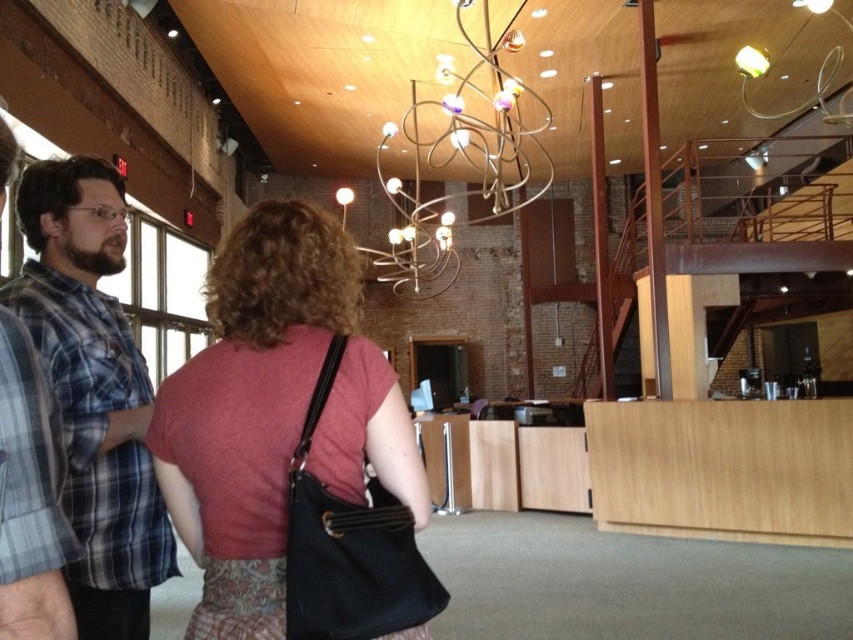
Between point (79, 420) and point (379, 140), which one is positioned in front?

Positioned in front is point (79, 420).

Is blue plaid shirt at left wider than metallic wire chandelier at upper center?

No, blue plaid shirt at left is not wider than metallic wire chandelier at upper center.

This screenshot has height=640, width=853. I want to click on blue plaid shirt at left, so [94, 390].

Is matte black purse at center to the left of metallic wire chandelier at upper center from the viewer's perspective?

Yes, matte black purse at center is to the left of metallic wire chandelier at upper center.

Does point (148, 449) lie behind point (463, 29)?

No, it is in front of (463, 29).

The height and width of the screenshot is (640, 853). I want to click on matte black purse at center, so click(x=273, y=412).

Is blue plaid shirt at left positioned at the back of plaid fabric shirt at left?

Yes, blue plaid shirt at left is further from the viewer.

Image resolution: width=853 pixels, height=640 pixels. What do you see at coordinates (94, 390) in the screenshot?
I see `blue plaid shirt at left` at bounding box center [94, 390].

Where is `blue plaid shirt at left`? The image size is (853, 640). blue plaid shirt at left is located at coordinates (94, 390).